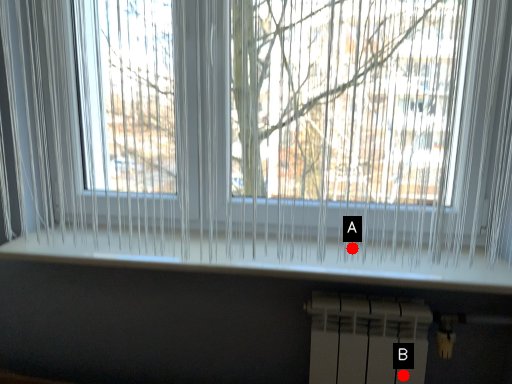
Question: Two points are circled on the image, labeled by A and B beside each circle. Which point is farther from the camera taking this photo?

Choices:
 (A) A is further
 (B) B is further

Answer: (B)